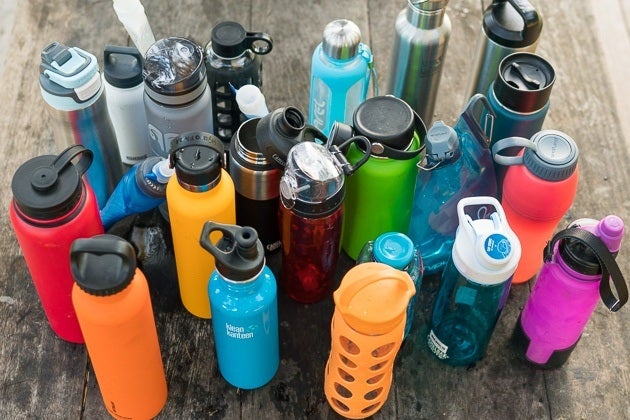
Locate an element on the screen. Image resolution: width=630 pixels, height=420 pixels. wooden planks is located at coordinates (573, 39), (466, 38), (302, 32), (183, 20), (84, 25), (20, 17).